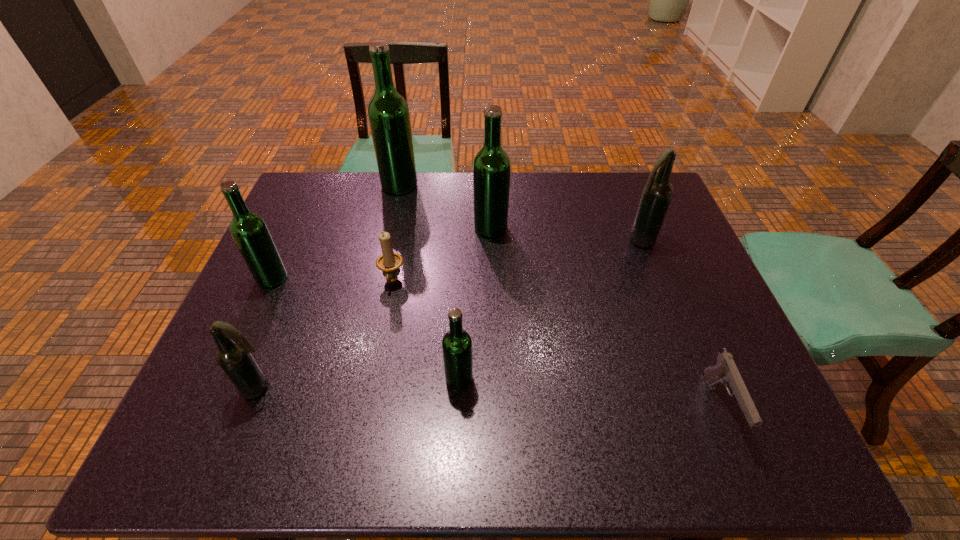
Select which beer bottle is the second closest to the third smallest green beer bottle. Please provide its 2D coordinates. Your answer should be formatted as a tuple, i.e. [(x, y)], where the tuple contains the x and y coordinates of a point satisfying the conditions above.

[(657, 193)]

Identify which green beer bottle is the second closest to the biggest green beer bottle. Please provide its 2D coordinates. Your answer should be formatted as a tuple, i.e. [(x, y)], where the tuple contains the x and y coordinates of a point satisfying the conditions above.

[(249, 230)]

You are a GUI agent. You are given a task and a screenshot of the screen. Output one action in this format:
    pyautogui.click(x=<x>, y=<y>)
    Task: Click on the green beer bottle that is the closest to the nearest green beer bottle
    This screenshot has height=540, width=960.
    Given the screenshot: What is the action you would take?
    pyautogui.click(x=491, y=167)

What are the coordinates of `vacant space that satisfies the following two spatial constraints: 1. on the front side of the third nearest green beer bottle; 2. on the right side of the right dark beer bottle` in the screenshot? It's located at (491, 240).

The height and width of the screenshot is (540, 960). Identify the location of free location that satisfies the following two spatial constraints: 1. on the front side of the third nearest beer bottle; 2. on the left side of the nearest green beer bottle. coord(227,379).

The width and height of the screenshot is (960, 540). Identify the location of free spot that satisfies the following two spatial constraints: 1. on the handle side of the smallest green beer bottle; 2. on the left side of the seventh tallest object. [x=373, y=379].